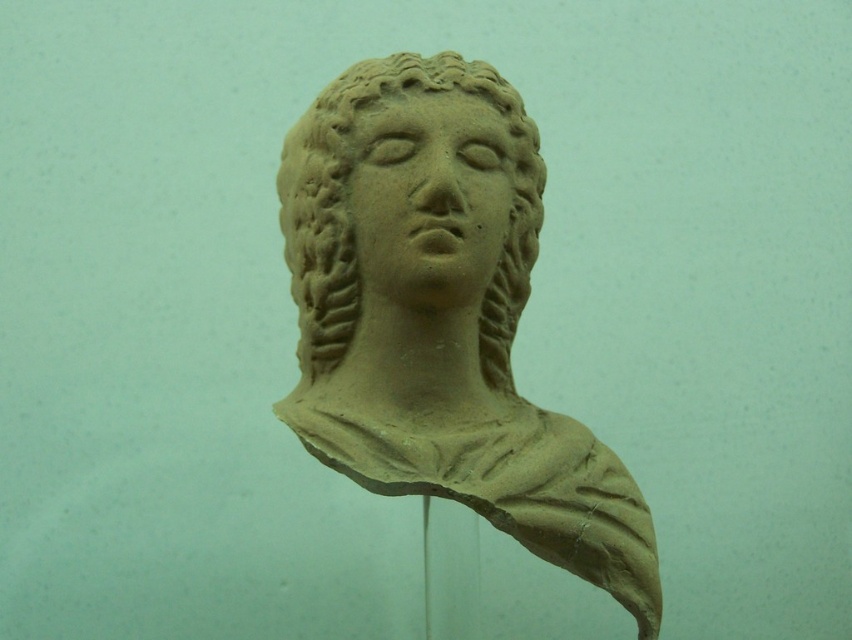
You are an art conservator examining the classical sculpture. You need to determine if the matte clay face at center will fit into a preservation container designed for objects no wider than the matte clay bust at center. Can the container accommodate the face?

The matte clay bust at center is wider than the matte clay face at center, so the preservation container designed for the bust can accommodate the face since the face is narrower.